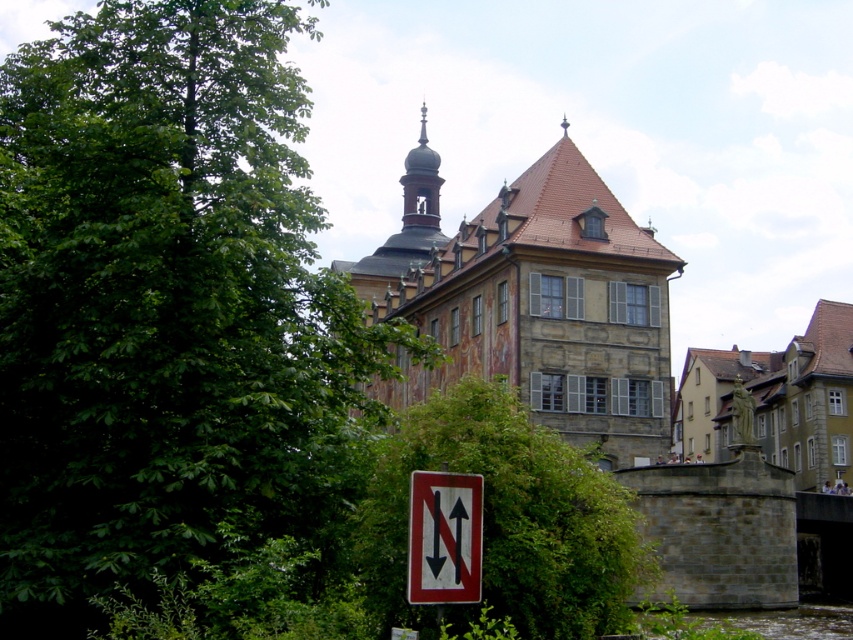
Does green leafy tree at left come behind stone statue at right?

No, green leafy tree at left is closer to the viewer.

Between point (267, 134) and point (820, 365), which one is positioned behind?

Point (820, 365)

The height and width of the screenshot is (640, 853). Identify the location of green leafy tree at left. (165, 307).

Is point (567, 196) positioned in front of point (515, 500)?

No, it is behind (515, 500).

Is stone building at center closer to the viewer compared to green leafy tree at center?

No, it is behind green leafy tree at center.

This screenshot has width=853, height=640. Describe the element at coordinates (581, 321) in the screenshot. I see `stone building at center` at that location.

Where is `stone building at center`? Image resolution: width=853 pixels, height=640 pixels. stone building at center is located at coordinates (581, 321).

Does stone building at center have a lesser height compared to white plastic sign at lower center?

No, stone building at center is not shorter than white plastic sign at lower center.

Which is in front, point (605, 445) or point (410, 541)?

Positioned in front is point (410, 541).

Which is behind, point (720, 442) or point (469, 486)?

The point (720, 442) is behind.

In order to click on stone building at center in this screenshot , I will do `click(581, 321)`.